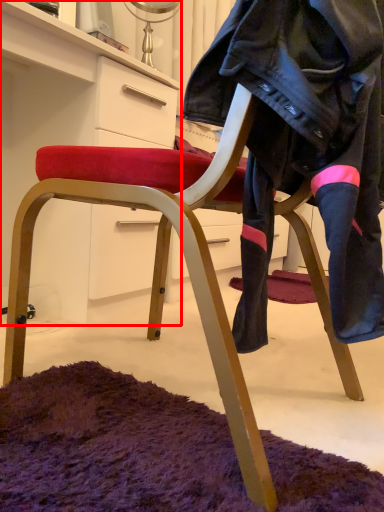
Question: In this image, where is cabinetry (annotated by the red box) located relative to leather jacket?

Choices:
 (A) right
 (B) left

Answer: (B)